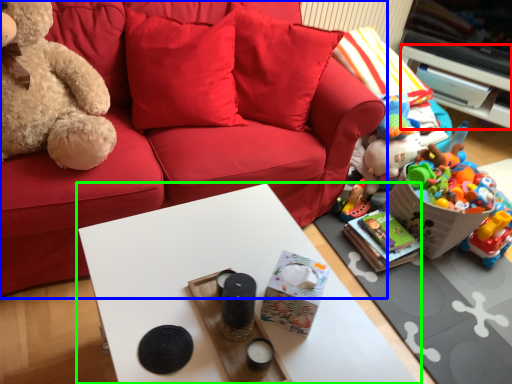
Question: Which object is positioned closest to cabinetry (highlighted by a red box)? Select from studio couch (highlighted by a blue box) and table (highlighted by a green box).

Choices:
 (A) studio couch
 (B) table

Answer: (A)